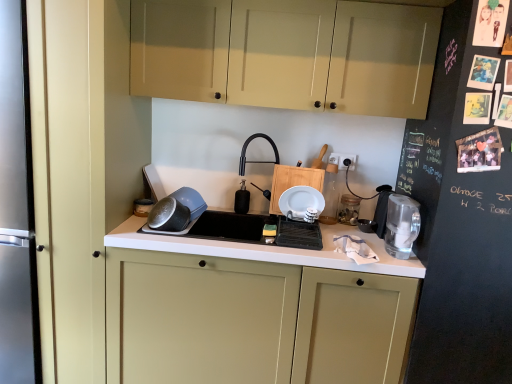
Identify the location of vacant area that lies in front of translucent glass jar at upper right, placed as the second appliance when sorted from right to left. (340, 229).